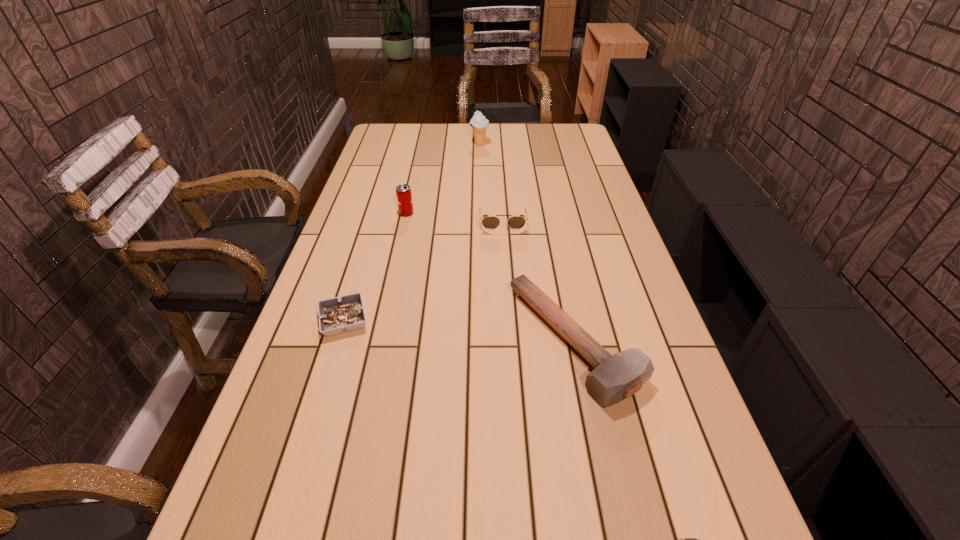
Identify the location of free space located on the front lenses of the sunglasses. Image resolution: width=960 pixels, height=540 pixels. (506, 276).

The image size is (960, 540). In order to click on vacant space situated 0.250m on the back of the mallet in this screenshot , I will do `click(552, 233)`.

This screenshot has height=540, width=960. In order to click on free space located 0.250m on the front of the farther ashtray in this screenshot , I will do `click(308, 436)`.

Identify the location of object located in the far edge section of the desktop. (479, 123).

Where is `object that is positioned at the left edge`? object that is positioned at the left edge is located at coordinates (345, 314).

Where is `object at the right edge`? object at the right edge is located at coordinates (615, 377).

The image size is (960, 540). I want to click on free spot at the far edge of the desktop, so click(432, 128).

You are a GUI agent. You are given a task and a screenshot of the screen. Output one action in this format:
    pyautogui.click(x=<x>, y=<y>)
    Task: Click on the free location at the left edge of the desktop
    
    Given the screenshot: What is the action you would take?
    pyautogui.click(x=358, y=214)

Locate an element on the screen. This screenshot has width=960, height=540. vacant space at the right edge of the desktop is located at coordinates (605, 309).

Identify the location of vacant area at the far left corner. (378, 129).